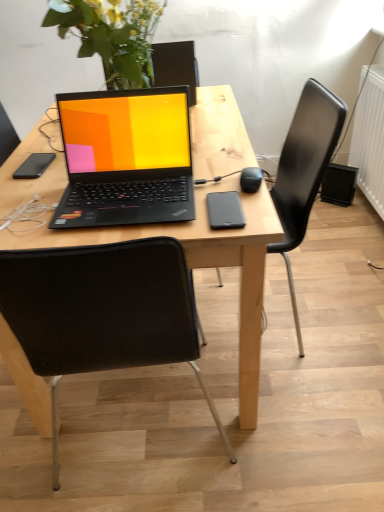
Find the location of a particular element. Image resolution: width=384 pixels, height=512 pixels. free spot in front of black matte phone at left, arranged as the second mobile phone when viewed from the right is located at coordinates pyautogui.click(x=34, y=192).